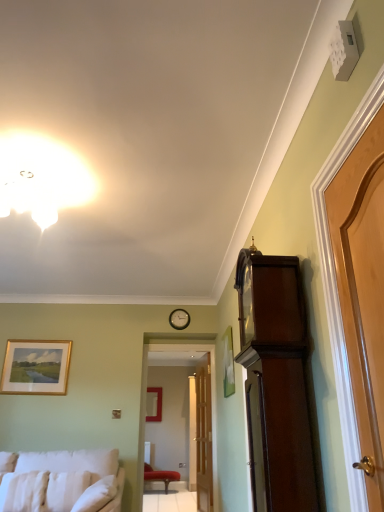
Question: Should I look upward or downward to see white soft pillow at lower left, which is counted as the 3th pillow, starting from the left?

Choices:
 (A) down
 (B) up

Answer: (A)

Question: From the image's perspective, would you say light brown wooden door at right, the first door when ordered from right to left, is shown under white glossy light fixture at upper center?

Choices:
 (A) yes
 (B) no

Answer: (A)

Question: Considering the relative sizes of light brown wooden door at right, the first door when ordered from right to left, and white glossy light fixture at upper center in the image provided, is light brown wooden door at right, the first door when ordered from right to left, shorter than white glossy light fixture at upper center?

Choices:
 (A) yes
 (B) no

Answer: (B)

Question: Is light brown wooden door at right, which ranks as the second door in back-to-front order, closer to the viewer compared to white glossy light fixture at upper center?

Choices:
 (A) no
 (B) yes

Answer: (B)

Question: Is light brown wooden door at right, the first door when ordered from right to left, facing away from white glossy light fixture at upper center?

Choices:
 (A) yes
 (B) no

Answer: (B)

Question: Does light brown wooden door at right, the 2th door positioned from the bottom, have a smaller size compared to white glossy light fixture at upper center?

Choices:
 (A) yes
 (B) no

Answer: (A)

Question: Does light brown wooden door at right, which ranks as the second door in back-to-front order, have a greater height compared to white glossy light fixture at upper center?

Choices:
 (A) yes
 (B) no

Answer: (A)

Question: Considering the relative sizes of velvet red chair at center and light brown wooden door at right, the 2th door positioned from the bottom, in the image provided, is velvet red chair at center thinner than light brown wooden door at right, the 2th door positioned from the bottom,?

Choices:
 (A) no
 (B) yes

Answer: (A)

Question: From the image's perspective, is velvet red chair at center under light brown wooden door at right, the first door when ordered from right to left?

Choices:
 (A) no
 (B) yes

Answer: (B)

Question: Is light brown wooden door at right, the first door positioned from the front, inside velvet red chair at center?

Choices:
 (A) yes
 (B) no

Answer: (B)

Question: Does velvet red chair at center appear on the right side of light brown wooden door at right, the first door positioned from the front?

Choices:
 (A) yes
 (B) no

Answer: (B)

Question: Are velvet red chair at center and light brown wooden door at right, the 2th door from the left, located far from each other?

Choices:
 (A) no
 (B) yes

Answer: (B)

Question: Is velvet red chair at center behind light brown wooden door at right, the first door positioned from the front?

Choices:
 (A) yes
 (B) no

Answer: (A)

Question: From the image's perspective, is wooden clock at center under white fabric studio couch at lower left?

Choices:
 (A) yes
 (B) no

Answer: (B)